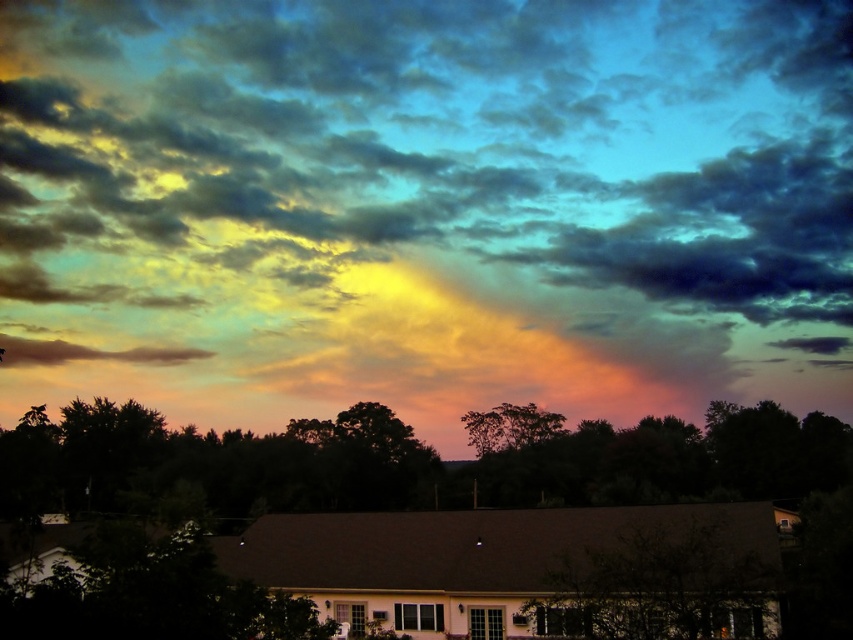
Question: Is cloudy sky at upper center bigger than matte brown cloud at lower left?

Choices:
 (A) yes
 (B) no

Answer: (A)

Question: Which object is farther from the camera taking this photo?

Choices:
 (A) cloudy sky at upper center
 (B) matte brown cloud at lower left

Answer: (B)

Question: Is green leafy tree at lower center to the left of matte brown cloud at lower left from the viewer's perspective?

Choices:
 (A) yes
 (B) no

Answer: (B)

Question: Does cloudy sky at upper center appear on the left side of green leafy tree at lower center?

Choices:
 (A) no
 (B) yes

Answer: (B)

Question: Which point is closer to the camera?

Choices:
 (A) (558, 413)
 (B) (737, 541)
 (C) (16, 358)

Answer: (B)

Question: Which object appears closest to the camera in this image?

Choices:
 (A) green leafy tree at lower center
 (B) matte brown cloud at lower left

Answer: (A)